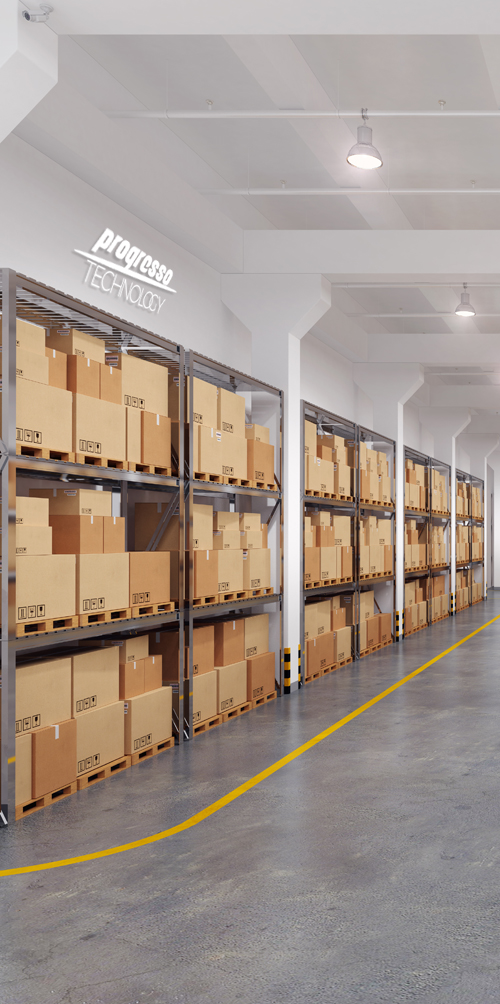
You are a GUI agent. You are given a task and a screenshot of the screen. Output one action in this format:
    pyautogui.click(x=<x>, y=<y>)
    Task: Click on the column
    The height and width of the screenshot is (1004, 500).
    Given the screenshot: What is the action you would take?
    pyautogui.click(x=281, y=337), pyautogui.click(x=382, y=393), pyautogui.click(x=445, y=426), pyautogui.click(x=478, y=450)